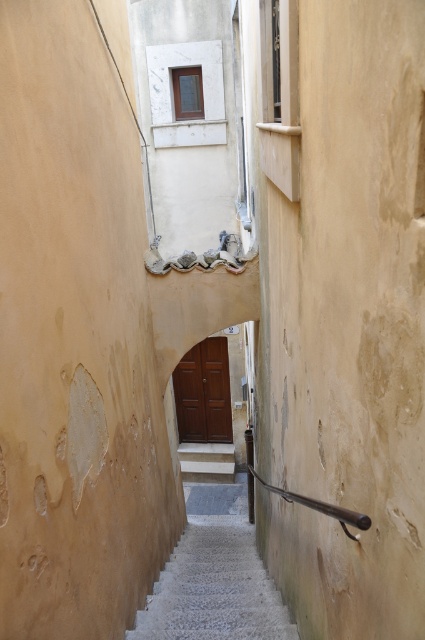
Does white concrete stairs at center have a smaller size compared to white marble stairs at center?

Correct, white concrete stairs at center occupies less space than white marble stairs at center.

Is white concrete stairs at center shorter than white marble stairs at center?

Indeed, white concrete stairs at center has a lesser height compared to white marble stairs at center.

Between point (280, 604) and point (229, 480), which one is positioned in front?

Point (280, 604) is in front.

Locate an element on the screen. white concrete stairs at center is located at coordinates (215, 577).